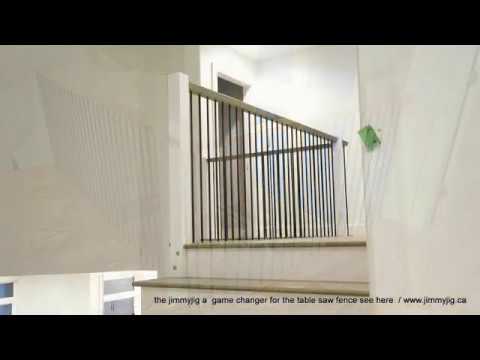
Identify the location of something green and blurred on wall - possibly glass. This screenshot has width=480, height=360. pyautogui.click(x=368, y=133).